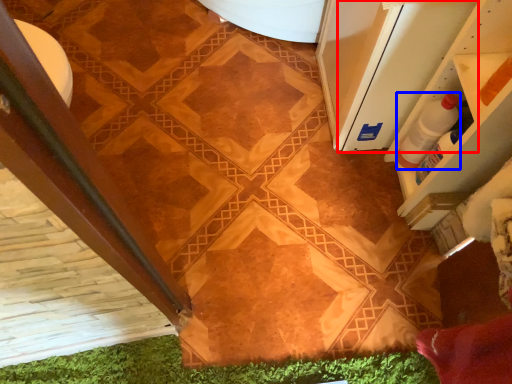
Question: Which object appears farthest to the camera in this image, screen door (highlighted by a red box) or bottle (highlighted by a blue box)?

Choices:
 (A) screen door
 (B) bottle

Answer: (B)